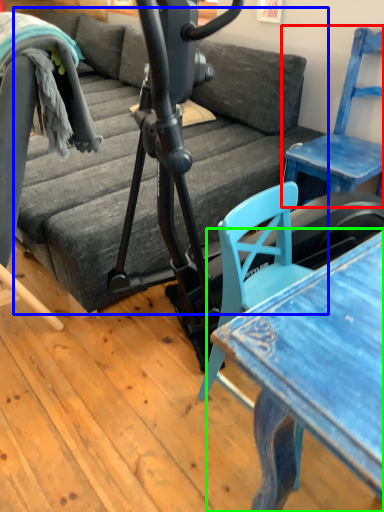
Question: Estimate the real-world distances between objects in this image. Which object is farther from chair (highlighted by a red box), studio couch (highlighted by a blue box) or table (highlighted by a green box)?

Choices:
 (A) studio couch
 (B) table

Answer: (B)